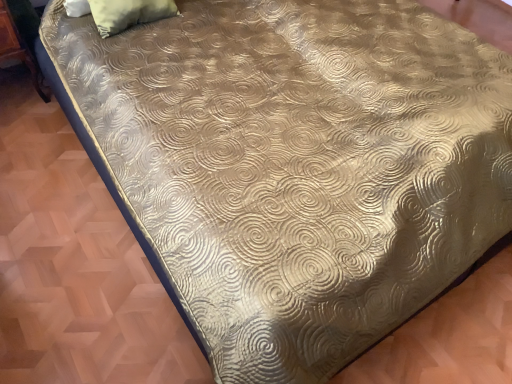
Where is `vacant space underneath wooden dresser at left (from a real-world perspective)`? This screenshot has width=512, height=384. vacant space underneath wooden dresser at left (from a real-world perspective) is located at coordinates (19, 99).